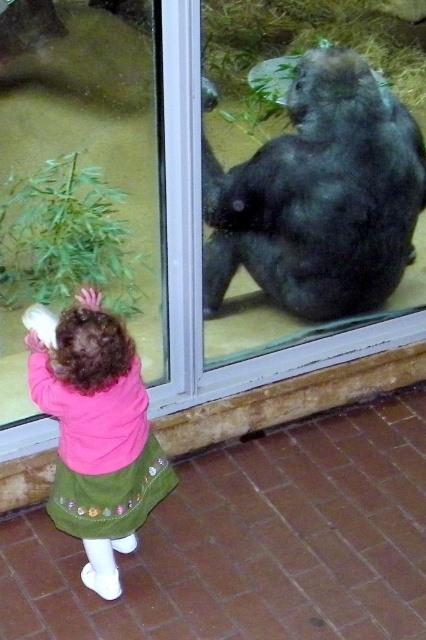
Consider the image. You are a zookeeper who needs to retrieve the pink fleece jacket at lower left from behind the transparent glass door at upper center. Can you reach it without opening the door?

The pink fleece jacket at lower left is to the left of the transparent glass door at upper center, so you can reach it without opening the door by extending your arm to the left side of the door.

You are a zookeeper trying to determine if a small toy can be placed between the pink fleece jacket at lower left and the transparent glass door at upper center. Based on their heights, will the toy fit without being blocked?

The pink fleece jacket at lower left is shorter than the transparent glass door at upper center, so the toy can be placed between them as the jacket is shorter and won

You are a zookeeper who needs to ensure that the dark gray fur at center and the pink fleece jacket at lower left are visible to visitors. Based on their widths, which object should be placed closer to the viewing area to ensure maximum visibility?

The dark gray fur at center should be placed closer to the viewing area because it is wider than the pink fleece jacket at lower left, making it more noticeable when positioned nearer to visitors.